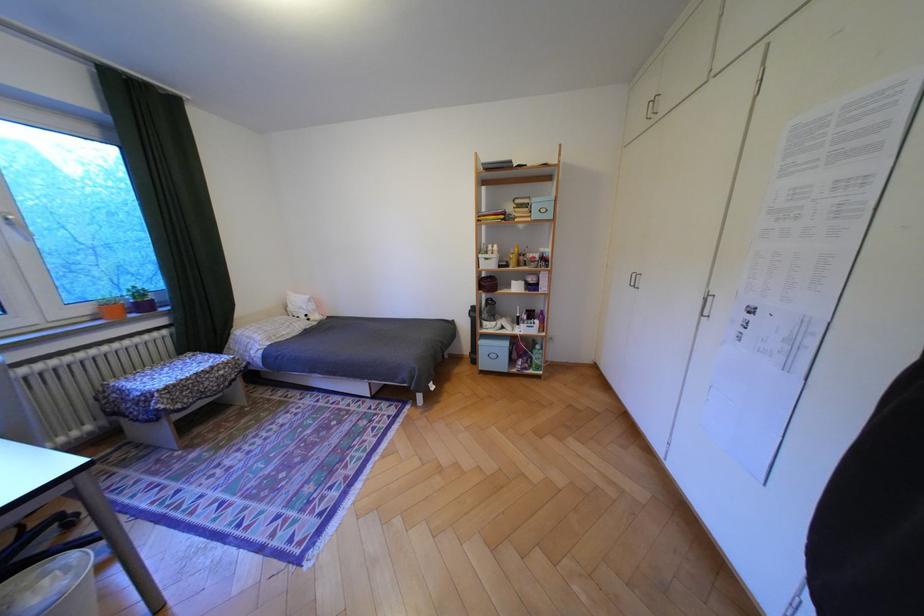
The location [488,257] corresponds to which object?

It corresponds to the white tissue box in the image.